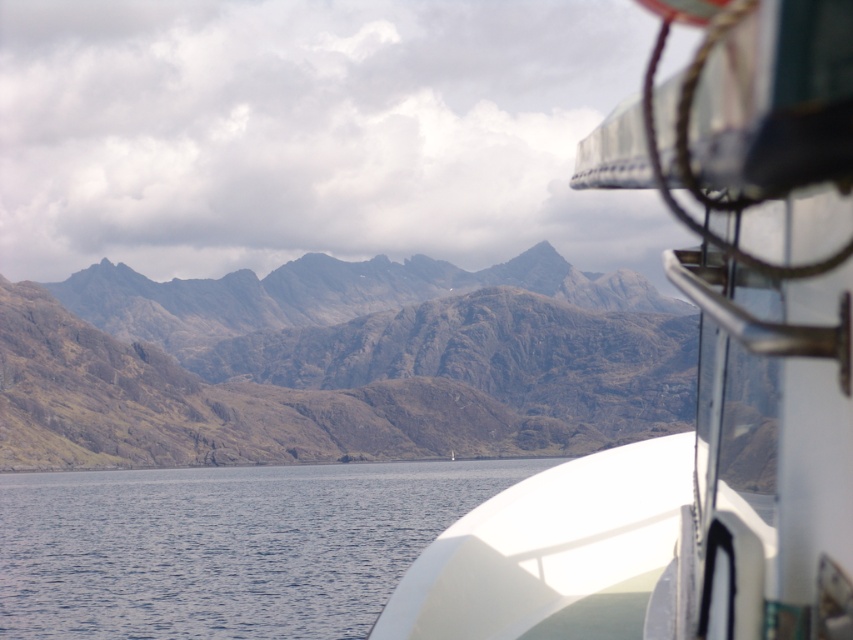
Question: Which point is farther to the camera?

Choices:
 (A) white glossy boat at upper right
 (B) blue water at lower left
 (C) brown rough mountain at center

Answer: (C)

Question: Does white glossy boat at upper right lie behind brown rough mountain at center?

Choices:
 (A) no
 (B) yes

Answer: (A)

Question: Which of the following is the closest to the observer?

Choices:
 (A) (759, 38)
 (B) (566, 417)

Answer: (A)

Question: Does white glossy boat at upper right have a greater width compared to brown rough mountain at center?

Choices:
 (A) no
 (B) yes

Answer: (A)

Question: Among these points, which one is farthest from the camera?

Choices:
 (A) (612, 596)
 (B) (39, 308)
 (C) (466, 481)

Answer: (B)

Question: Is brown rough mountain at center bigger than blue water at lower left?

Choices:
 (A) no
 (B) yes

Answer: (B)